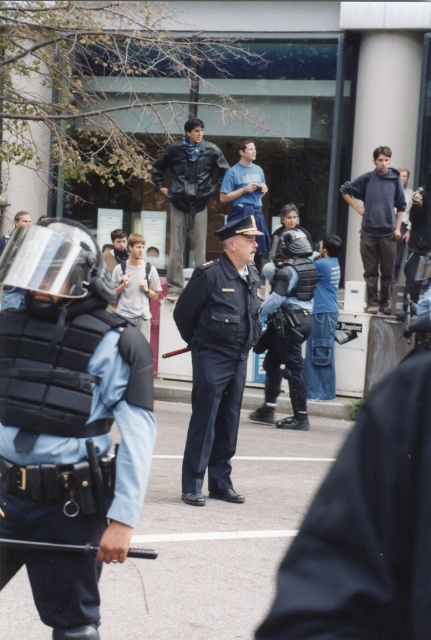
Is dark blue uniform at center closer to camera compared to leather jacket at center?

That is True.

Which is more to the left, dark blue uniform at center or leather jacket at center?

Positioned to the left is leather jacket at center.

Between point (256, 332) and point (208, 196), which one is positioned in front?

Point (256, 332) is more forward.

Find the location of a particular element. dark blue uniform at center is located at coordinates (218, 356).

From the picture: Can you confirm if matte black vest at left is shorter than light gray uniform at center?

Incorrect, matte black vest at left's height does not fall short of light gray uniform at center's.

Who is more distant from viewer, (33, 470) or (118, 289)?

Positioned behind is point (118, 289).

Find the location of a particular element. Image resolution: width=431 pixels, height=640 pixels. matte black vest at left is located at coordinates (68, 420).

Who is more forward, (218, 285) or (149, 307)?

Positioned in front is point (218, 285).

Measure the distance between dark blue uniform at center and camera.

The distance of dark blue uniform at center from camera is 22.60 feet.

Does point (246, 317) come in front of point (119, 301)?

That is True.

At what (x,y) coordinates should I click in order to perform the action: click on dark blue uniform at center. Please return your answer as a coordinate pair (x, y). The height and width of the screenshot is (640, 431). Looking at the image, I should click on (218, 356).